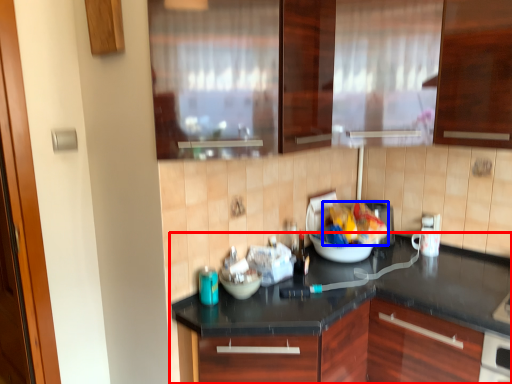
Question: Which object is further to the camera taking this photo, countertop (highlighted by a red box) or food (highlighted by a blue box)?

Choices:
 (A) countertop
 (B) food

Answer: (B)